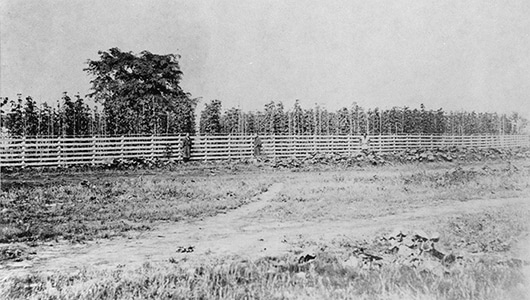
Locate an element on the screen. The height and width of the screenshot is (300, 530). chest is located at coordinates (187, 145), (256, 143), (364, 140).